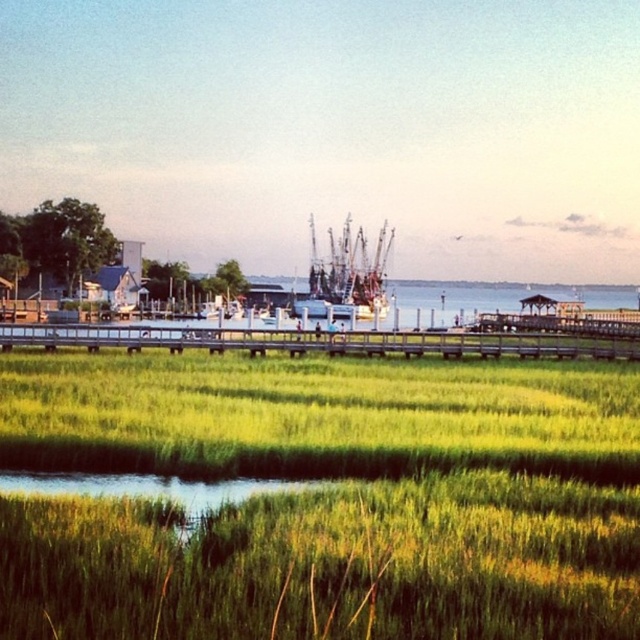
You are planning to set up a small tent for a picnic. You have two options for the location on the image provided. The first option is on the green grassy at center and the second is on the wooden at center. Considering the width of the areas, which location would provide more space for your tent?

The wooden at center has a greater width compared to the green grassy at center, so the wooden at center would provide more space for the tent.